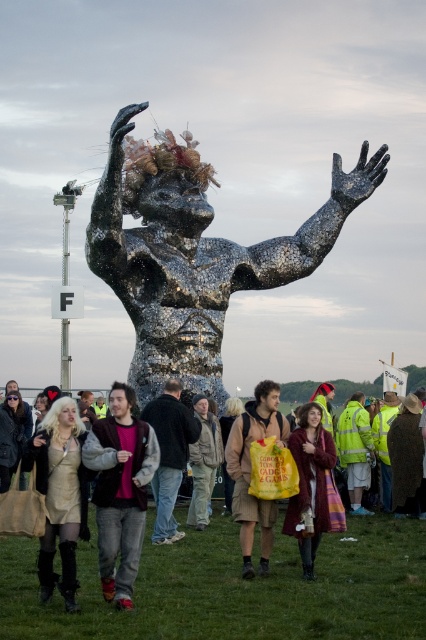
You are a photographer trying to capture a photo of the metallic sculpture. You notice two people wearing jackets in the foreground. Which jacket is positioned to the right of the other? The jackets are the matte black jacket at center and the camouflage jacket at center.

The matte black jacket at center is to the right of the camouflage jacket at center, so the matte black jacket at center is positioned to the right of the camouflage jacket at center.

You are a photographer at the festival and want to capture both the jeans at center and the yellow reflective jacket at center in the same frame. Given that your camera has a focal length of 50mm, which is suitable for a field of view that can cover up to 60 feet, will you be able to include both items in your photo?

The jeans at center and yellow reflective jacket at center are 58.81 feet apart from each other. Since the camera can cover up to 60 feet, the distance between them is within the field of view. Therefore, you can include both items in your photo.